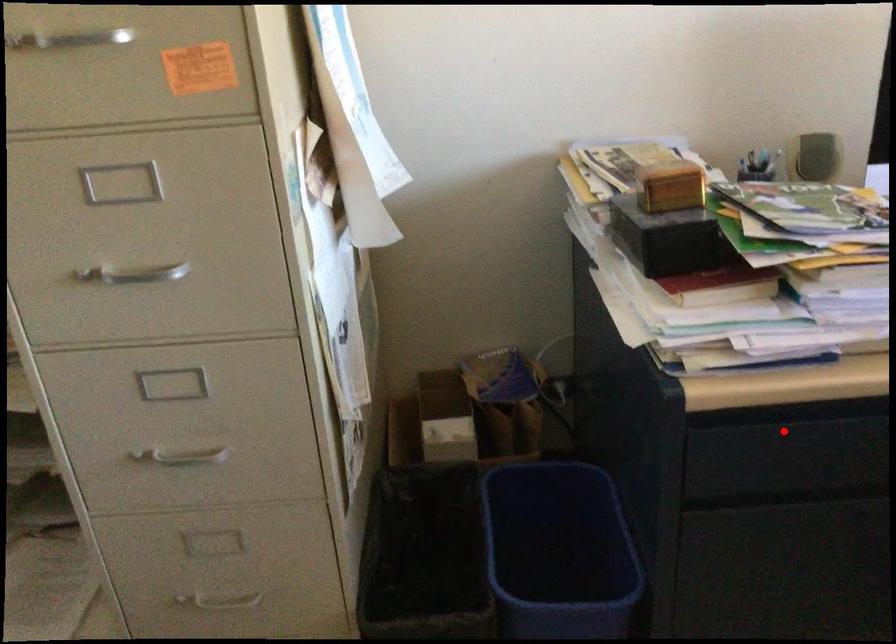
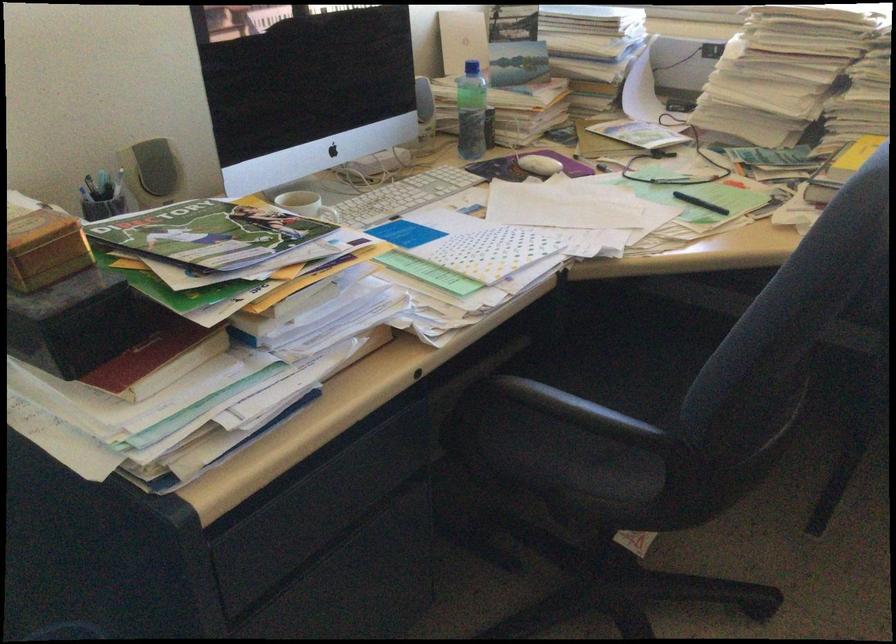
Question: I am providing you with two images of the same scene from different viewpoints. A red point is marked on the first image. Is the red point's position out of view in image 2?

Choices:
 (A) Yes
 (B) No

Answer: (B)